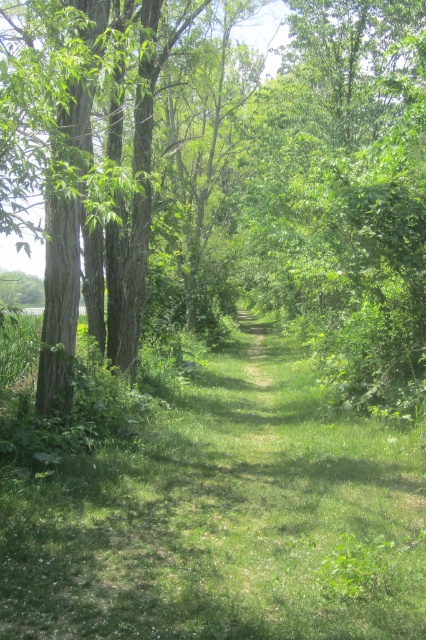
Question: Is green leafy tree at center closer to the viewer compared to green grass at center?

Choices:
 (A) yes
 (B) no

Answer: (B)

Question: Does green leafy tree at center have a smaller size compared to green grass at center?

Choices:
 (A) yes
 (B) no

Answer: (B)

Question: Does green leafy tree at center lie in front of green grass at center?

Choices:
 (A) no
 (B) yes

Answer: (A)

Question: Which point is closer to the camera taking this photo?

Choices:
 (A) (49, 264)
 (B) (340, 513)

Answer: (B)

Question: Among these objects, which one is farthest from the camera?

Choices:
 (A) green grass at center
 (B) green leafy tree at center

Answer: (B)